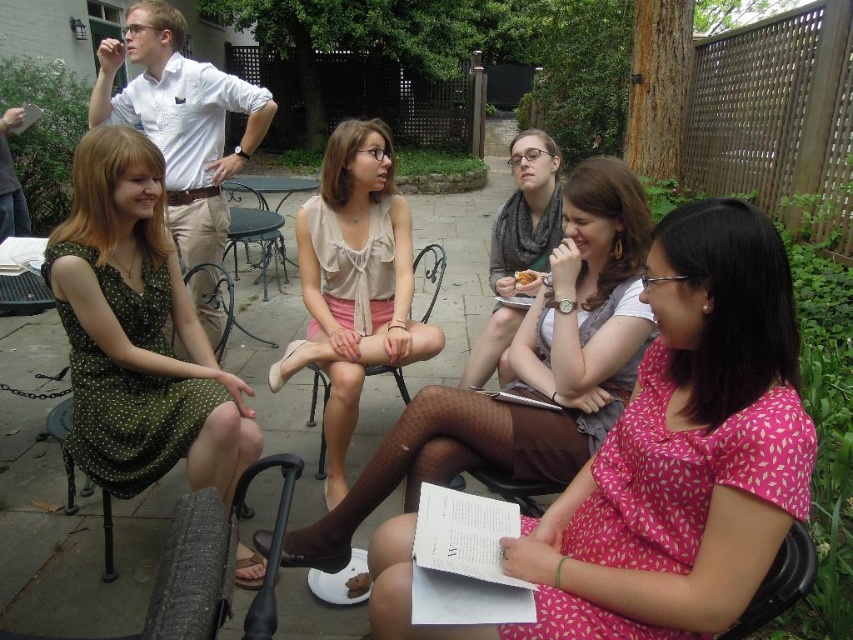
Can you confirm if light beige chiffon blouse at center is positioned below brown crumbly cookie at lower center?

Actually, light beige chiffon blouse at center is above brown crumbly cookie at lower center.

Is point (635, 220) closer to camera compared to point (366, 573)?

Yes.

In order to click on light beige chiffon blouse at center in this screenshot , I will do `click(525, 371)`.

Is light beige chiffon blouse at center positioned before golden crispy pastry at center?

That is True.

From the picture: Is light beige chiffon blouse at center wider than golden crispy pastry at center?

Yes.

Between point (602, 205) and point (531, 275), which one is positioned in front?

Point (602, 205)

At what (x,y) coordinates should I click in order to perform the action: click on light beige chiffon blouse at center. Please return your answer as a coordinate pair (x, y). Looking at the image, I should click on (525, 371).

Consider the image. Between metallic dark brown chair at center and golden crispy pastry at center, which one has more height?

With more height is metallic dark brown chair at center.

Is metallic dark brown chair at center above golden crispy pastry at center?

Indeed, metallic dark brown chair at center is positioned over golden crispy pastry at center.

Is point (273, 234) farther from viewer compared to point (525, 284)?

Yes, it is.

Find the location of a particular element. metallic dark brown chair at center is located at coordinates (254, 232).